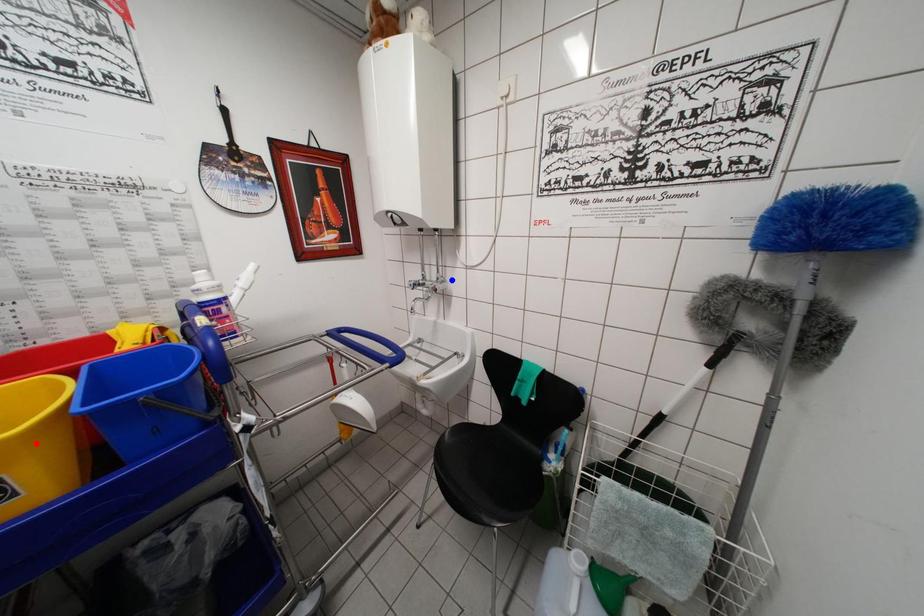
Question: Which of the two points in the image is closer to the camera?

Choices:
 (A) Blue point is closer.
 (B) Red point is closer.

Answer: (B)